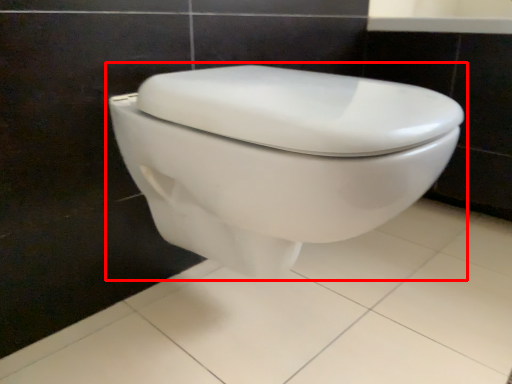
Question: From the image's perspective, what is the correct spatial relationship of toilet (annotated by the red box) in relation to porcelain?

Choices:
 (A) below
 (B) above

Answer: (B)